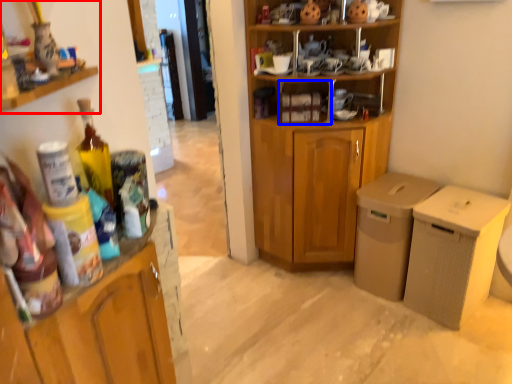
Question: Which object is further to the camera taking this photo, cabinetry (highlighted by a red box) or cabinet (highlighted by a blue box)?

Choices:
 (A) cabinetry
 (B) cabinet

Answer: (B)